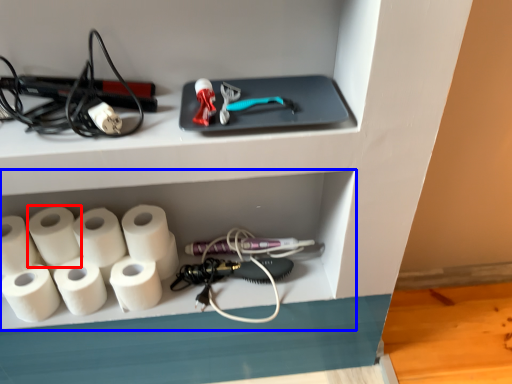
Question: Which object appears closest to the camera in this image, paper towel (highlighted by a red box) or shelf (highlighted by a blue box)?

Choices:
 (A) paper towel
 (B) shelf

Answer: (A)